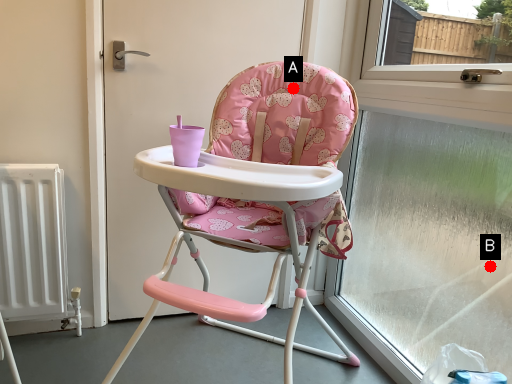
Question: Two points are circled on the image, labeled by A and B beside each circle. Which point appears closest to the camera in this image?

Choices:
 (A) A is closer
 (B) B is closer

Answer: (A)